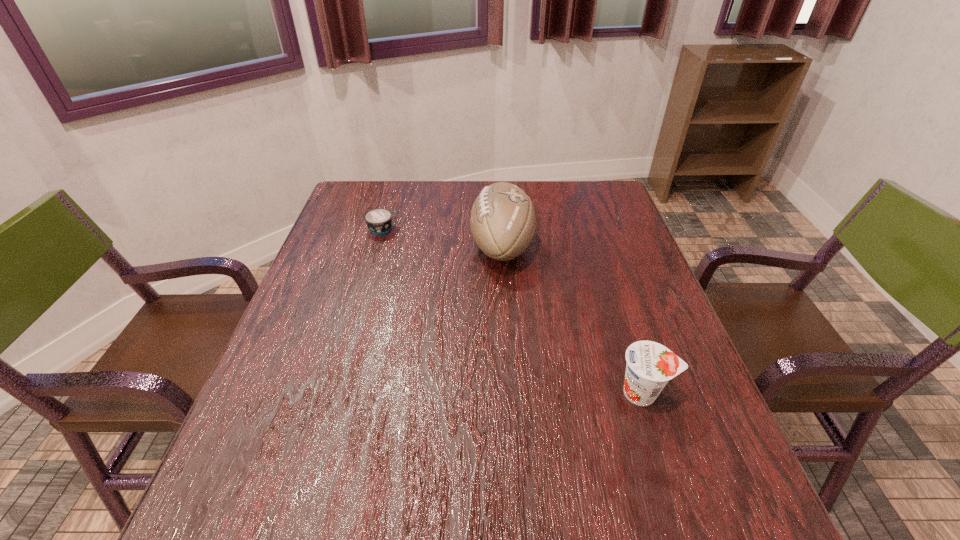
Find the location of a particular element. The height and width of the screenshot is (540, 960). vacant space located on the front of the leftmost object is located at coordinates (374, 257).

At what (x,y) coordinates should I click in order to perform the action: click on object located at the far edge. Please return your answer as a coordinate pair (x, y). The image size is (960, 540). Looking at the image, I should click on (502, 220).

Locate an element on the screen. Image resolution: width=960 pixels, height=540 pixels. object located at the left edge is located at coordinates (379, 220).

What are the coordinates of `object situated at the right edge` in the screenshot? It's located at (650, 365).

The image size is (960, 540). What are the coordinates of `vacant space at the far edge` in the screenshot? It's located at (439, 186).

In the image, there is a desktop. In order to click on free space at the near edge in this screenshot , I will do `click(547, 517)`.

Locate an element on the screen. This screenshot has height=540, width=960. free space at the left edge is located at coordinates (279, 352).

The height and width of the screenshot is (540, 960). What are the coordinates of `vacant space at the right edge of the desktop` in the screenshot? It's located at (698, 397).

In the image, there is a desktop. Where is `vacant region at the far left corner`? vacant region at the far left corner is located at coordinates (364, 209).

Find the location of `vacant region at the near left corner of the desktop`. vacant region at the near left corner of the desktop is located at coordinates (252, 516).